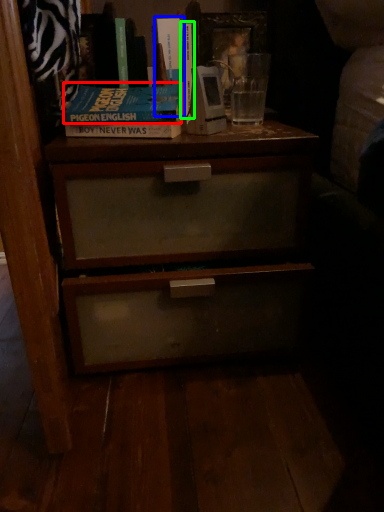
Question: Which object is the farthest from paperback book (highlighted by a red box)? Choose among these: book (highlighted by a blue box) or book (highlighted by a green box).

Choices:
 (A) book
 (B) book

Answer: (A)